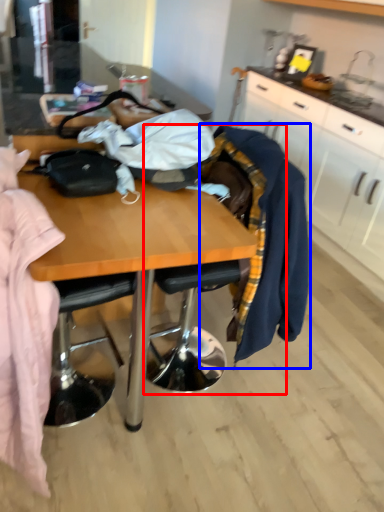
Question: Which object is further to the camera taking this photo, chair (highlighted by a red box) or clothing (highlighted by a blue box)?

Choices:
 (A) chair
 (B) clothing

Answer: (B)